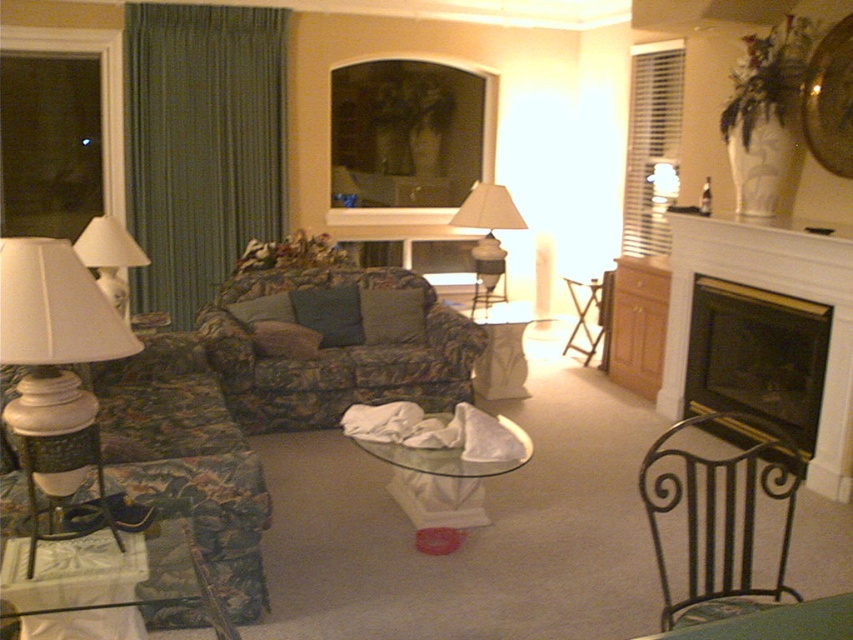
You are sitting on the sofa and want to place a book on the translucent glass table at center. However, you notice a white fabric lampshade at center above it. Is the lampshade in the way of placing the book on the table?

The translucent glass table at center is located below the white fabric lampshade at center, so the lampshade is above the table. Therefore, the lampshade is not in the way of placing the book on the table since it is positioned above.

You are planning to place a rectangular rug in the living room. The rug is 1.5 meters wide. You want to place it either in front of the white painted wood fireplace at right or under the transparent glass table at center. Based on their widths, which location would allow the rug to fit better?

The transparent glass table at center is wider than the white painted wood fireplace at right. Since the rug is 1.5 meters wide, it would fit better under the transparent glass table at center as it can accommodate the rug more appropriately based on the table width.

You are arranging a small party in the living room and need to place a 1.2 meter long rectangular table between the floral fabric couch at left and the transparent glass table at center. Will there be enough space?

The floral fabric couch at left is positioned on the left side of transparent glass table at center, so placing a 1.2 meter long table between them may not be feasible as the distance between the two objects might be insufficient to accommodate the table.